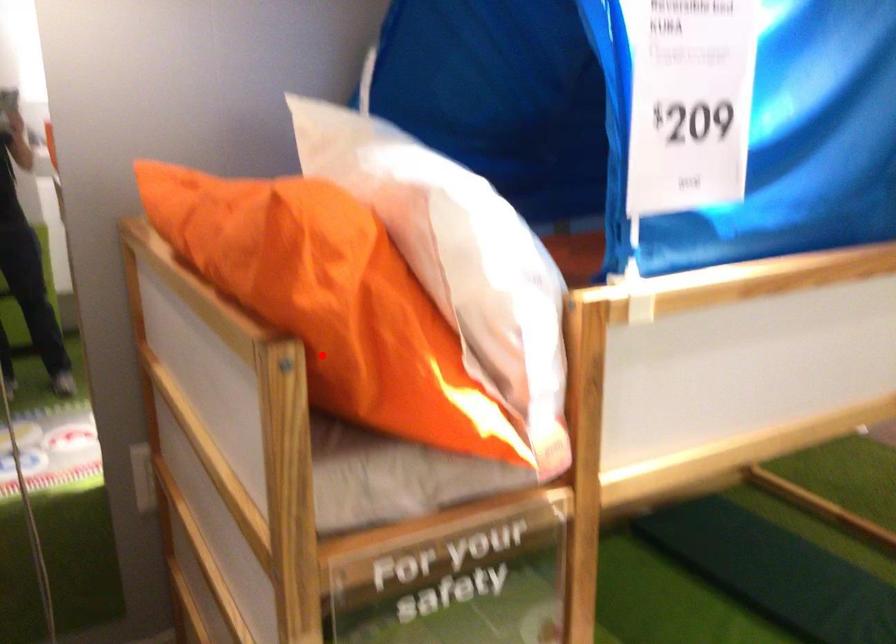
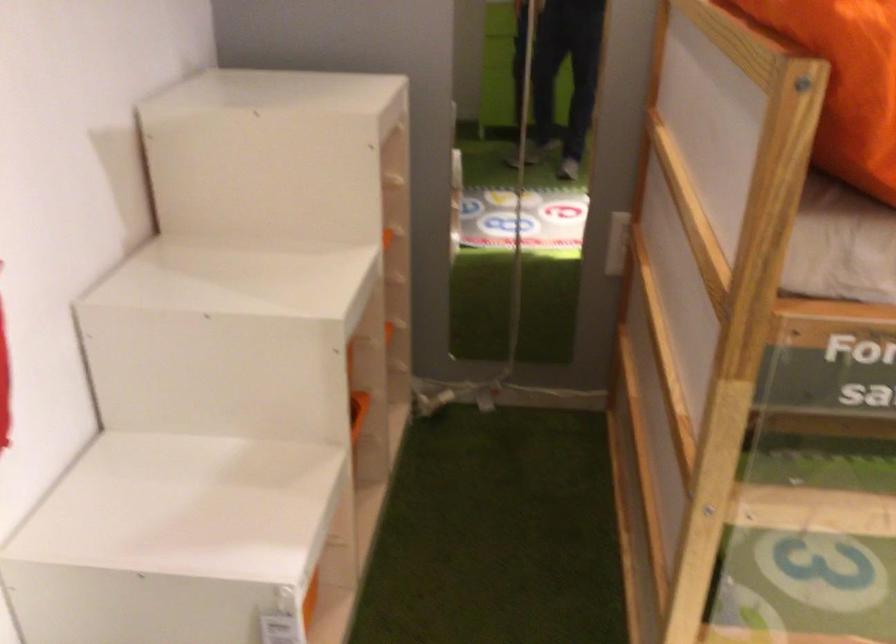
Find the pixel in the second image that matches the highlighted location in the first image.

(846, 82)